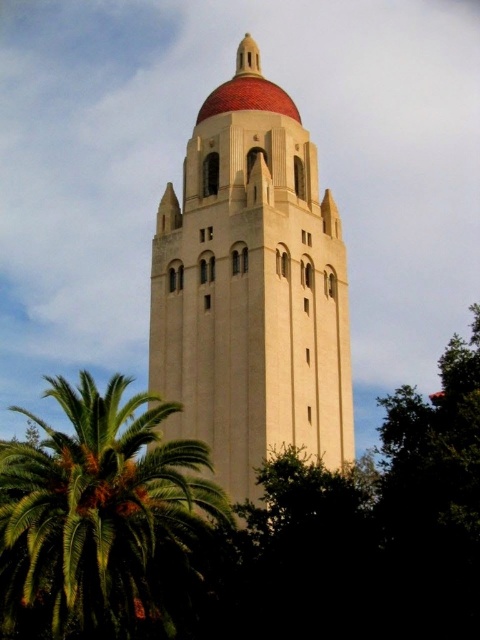
Question: Among these points, which one is nearest to the camera?

Choices:
 (A) (12, 536)
 (B) (192, 308)

Answer: (A)

Question: Which point is closer to the camera?

Choices:
 (A) beige stone tower at center
 (B) green leafy palm at lower left

Answer: (B)

Question: Can you confirm if beige stone tower at center is wider than green leafy palm at lower left?

Choices:
 (A) yes
 (B) no

Answer: (B)

Question: Which of the following is the closest to the observer?

Choices:
 (A) beige stone tower at center
 (B) green leafy palm at lower left

Answer: (B)

Question: Can you confirm if beige stone tower at center is wider than green leafy palm at lower left?

Choices:
 (A) no
 (B) yes

Answer: (A)

Question: Can you confirm if beige stone tower at center is positioned below green leafy palm at lower left?

Choices:
 (A) yes
 (B) no

Answer: (B)